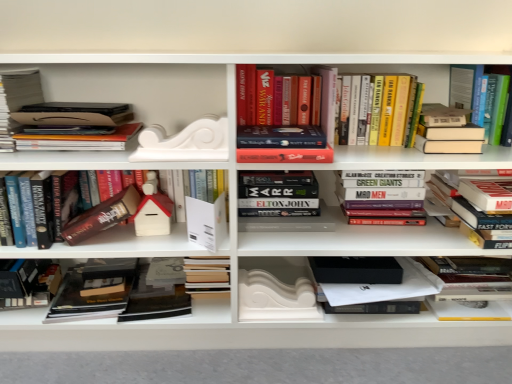
Question: Is matte brown book at left, which is counted as the fourth paperback book, starting from the right, to the right of hardcover book at upper right, the third book positioned from the right, from the viewer's perspective?

Choices:
 (A) no
 (B) yes

Answer: (A)

Question: Can you confirm if matte brown book at left, which is counted as the fourth paperback book, starting from the right, is wider than hardcover book at upper right, acting as the 8th book starting from the left?

Choices:
 (A) yes
 (B) no

Answer: (B)

Question: Is matte brown book at left, which is counted as the fourth paperback book, starting from the right, bigger than hardcover book at upper right, acting as the 8th book starting from the left?

Choices:
 (A) yes
 (B) no

Answer: (B)

Question: From a real-world perspective, is matte brown book at left, which is counted as the fourth paperback book, starting from the right, located beneath hardcover book at upper right, acting as the 8th book starting from the left?

Choices:
 (A) no
 (B) yes

Answer: (B)

Question: Is matte brown book at left, arranged as the second paperback book when viewed from the left, thinner than hardcover book at upper right, acting as the 8th book starting from the left?

Choices:
 (A) no
 (B) yes

Answer: (B)

Question: From a real-world perspective, does matte brown book at left, which is counted as the fourth paperback book, starting from the right, stand above hardcover book at upper right, acting as the 8th book starting from the left?

Choices:
 (A) yes
 (B) no

Answer: (B)

Question: Is white matte decorative piece at center, marked as the 1th paperback book in a right-to-left arrangement, positioned beyond the bounds of hardcover book at upper right, the third book positioned from the right?

Choices:
 (A) no
 (B) yes

Answer: (B)

Question: Is white matte decorative piece at center, marked as the 1th paperback book in a right-to-left arrangement, in front of hardcover book at upper right, the third book positioned from the right?

Choices:
 (A) no
 (B) yes

Answer: (A)

Question: Does white matte decorative piece at center, which appears as the 5th paperback book when viewed from the left, have a greater width compared to hardcover book at upper right, the third book positioned from the right?

Choices:
 (A) no
 (B) yes

Answer: (A)

Question: Is white matte decorative piece at center, which appears as the 5th paperback book when viewed from the left, to the right of hardcover book at upper right, acting as the 8th book starting from the left, from the viewer's perspective?

Choices:
 (A) no
 (B) yes

Answer: (A)

Question: Considering the relative sizes of white matte decorative piece at center, which appears as the 5th paperback book when viewed from the left, and hardcover book at upper right, acting as the 8th book starting from the left, in the image provided, is white matte decorative piece at center, which appears as the 5th paperback book when viewed from the left, bigger than hardcover book at upper right, acting as the 8th book starting from the left,?

Choices:
 (A) yes
 (B) no

Answer: (B)

Question: Is white matte decorative piece at center, which appears as the 5th paperback book when viewed from the left, positioned with its back to hardcover book at upper right, the third book positioned from the right?

Choices:
 (A) no
 (B) yes

Answer: (A)

Question: Is hardcover book at lower left, which appears as the first paperback book when viewed from the left, positioned in front of hardcover book at center, marked as the 5th book in a left-to-right arrangement?

Choices:
 (A) yes
 (B) no

Answer: (A)